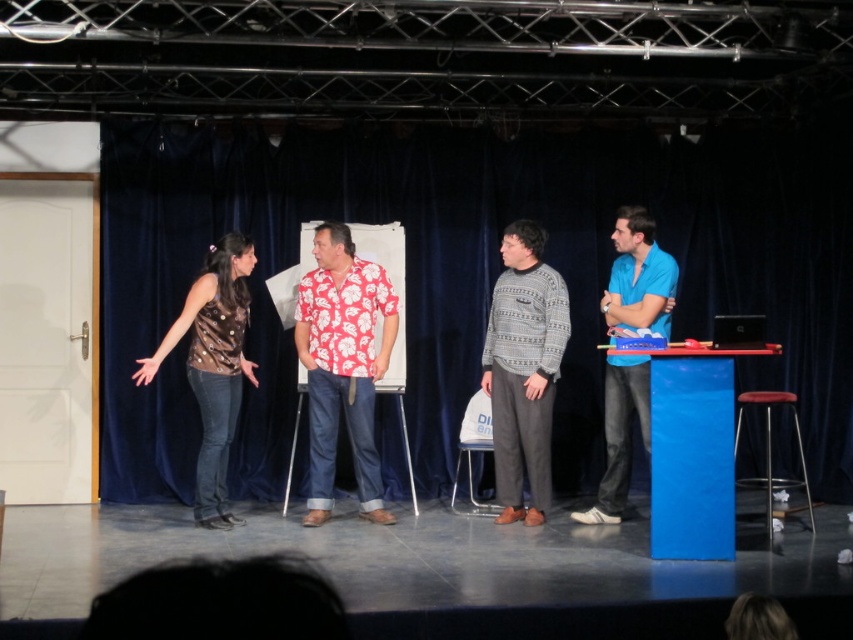
You are a stagehand preparing to hang a large decorative banner. You notice the black fabric curtain at upper left and the blue smooth shirt at right. Which object is more suitable for hanging the banner based on their sizes?

The black fabric curtain at upper left has a larger size compared to the blue smooth shirt at right, so it is more suitable for hanging the banner.